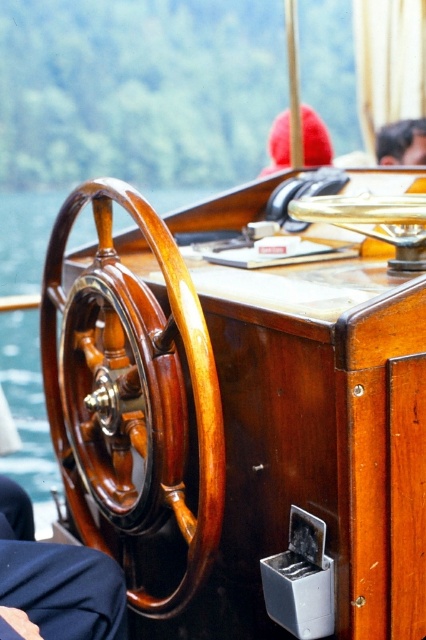
You are a sailor trying to place a new navigation tool on the dashboard. The tool requires a space wider than the shiny brown wood steering wheel at left. Can the brown leather hat at upper center area accommodate it?

The shiny brown wood steering wheel at left might be wider than the brown leather hat at upper center. Since the tool requires a space wider than the steering wheel, it cannot be placed in the area where the brown leather hat at upper center is located because that area might be narrower.

You are a sailor who needs to adjust the shiny brown wood steering wheel at left while also checking the wooden at center. Given that you have an arm span of 1.5 meters, can you comfortably reach both items without moving your position?

The shiny brown wood steering wheel at left and wooden at center are 1.03 meters apart, so yes, you can comfortably reach both items since the distance between them is within your arm span of 1.5 meters.

You are a sailor navigating the boat and need to adjust the controls. You notice two points marked on the dashboard. The first point is at coordinate point (120, 296) and the second is at coordinate point (288, 221). Which point is closer to you when you are facing the dashboard?

Point (120, 296) is in front of point (288, 221), so the first point is closer to you when facing the dashboard.